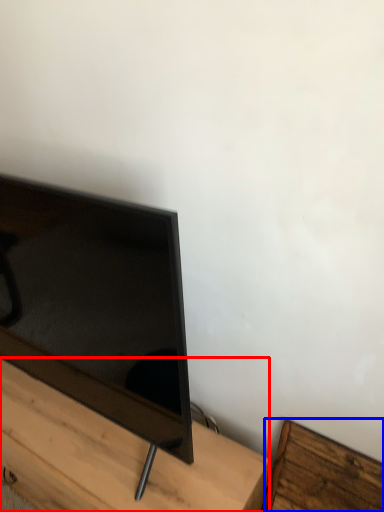
Question: Which point is closer to the camera, furniture (highlighted by a red box) or furniture (highlighted by a blue box)?

Choices:
 (A) furniture
 (B) furniture

Answer: (A)